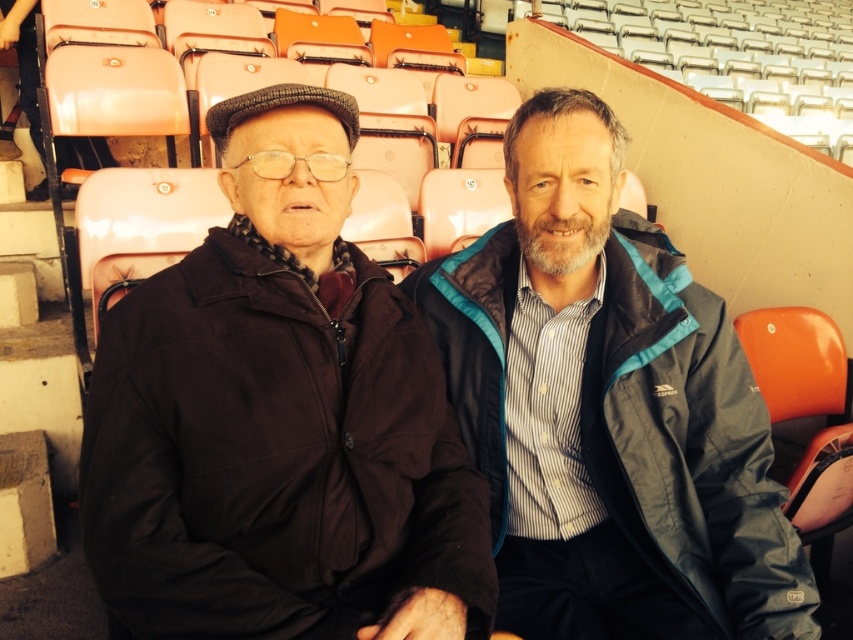
Is dark brown fabric jacket at left thinner than blue fabric jacket at center?

Yes.

Can you confirm if dark brown fabric jacket at left is bigger than blue fabric jacket at center?

No, dark brown fabric jacket at left is not bigger than blue fabric jacket at center.

This screenshot has width=853, height=640. I want to click on dark brown fabric jacket at left, so click(279, 419).